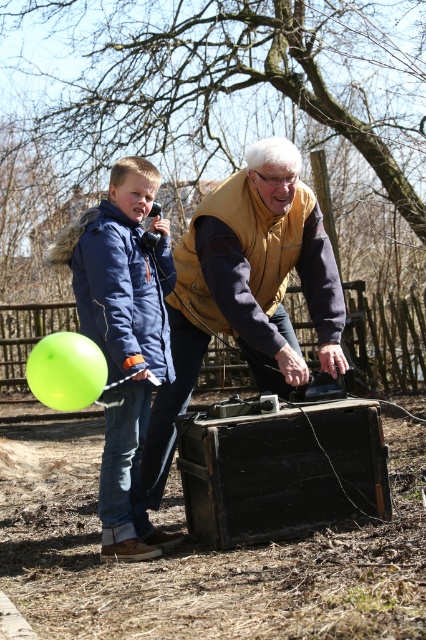
You are a photographer trying to capture a photo of the matte yellow vest at center and the matte blue jacket at left. Based on their positions, which one should you focus on first if you want to ensure both are in the frame without moving the camera?

The matte yellow vest at center is located above the matte blue jacket at left, so you should focus on the matte blue jacket at left first to ensure the entire frame captures both objects without needing to adjust the camera angle.

You are trying to determine which piece of clothing has a larger horizontal span in the image. Based on the scene, which one is wider between the matte yellow vest at center and the matte blue jacket at left?

The matte yellow vest at center is wider than the matte blue jacket at left according to the description.

You are a photographer trying to capture a photo of the matte blue jacket at left and the green rubber balloon at lower left. Based on their sizes in the image, which object should you focus on first if you want to ensure both are in frame without cropping?

The matte blue jacket at left is much taller than the green rubber balloon at lower left, so you should focus on the matte blue jacket at left first to ensure it fits within the frame, then adjust for the smaller balloon.